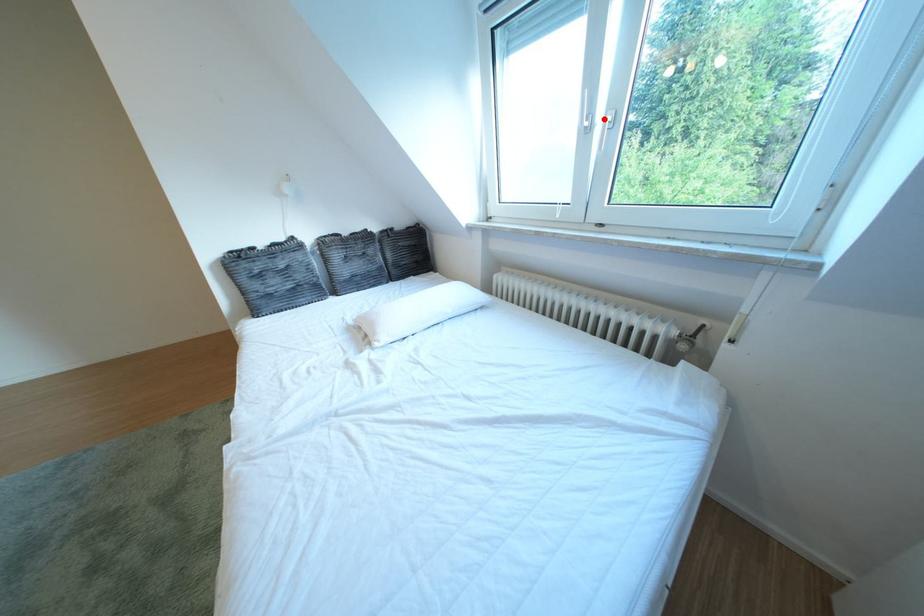
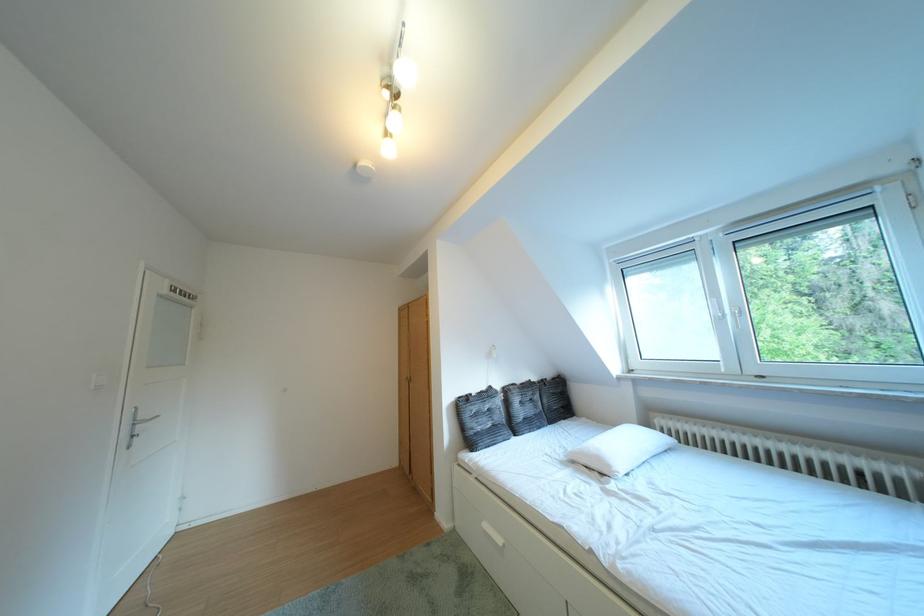
The point at the highlighted location is marked in the first image. Where is the corresponding point in the second image?

(736, 315)